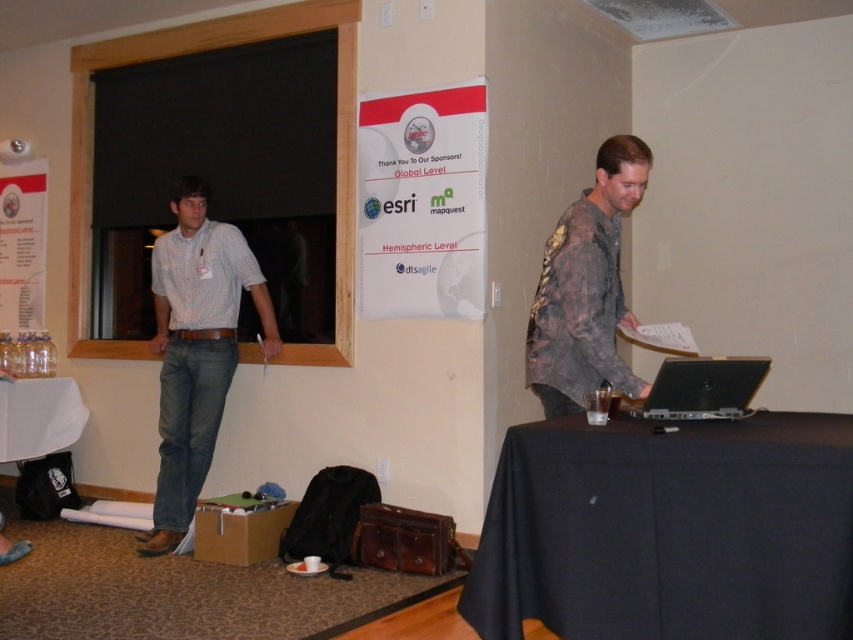
Who is shorter, checkered shirt at left or camouflage fabric shirt at right?

With less height is camouflage fabric shirt at right.

Does checkered shirt at left lie in front of camouflage fabric shirt at right?

No, checkered shirt at left is behind camouflage fabric shirt at right.

I want to click on checkered shirt at left, so click(x=196, y=349).

The image size is (853, 640). Identify the location of checkered shirt at left. (196, 349).

Which of these two, black fabric table at lower right or wooden frame window at left, stands shorter?

black fabric table at lower right is shorter.

Does black fabric table at lower right have a lesser height compared to wooden frame window at left?

Yes.

The image size is (853, 640). What do you see at coordinates (668, 531) in the screenshot? I see `black fabric table at lower right` at bounding box center [668, 531].

The width and height of the screenshot is (853, 640). I want to click on black fabric table at lower right, so click(x=668, y=531).

From the picture: Between camouflage fabric shirt at right and silver metallic laptop at center, which one has more height?

camouflage fabric shirt at right is taller.

Who is more distant from viewer, (546, 410) or (648, 417)?

The point (546, 410) is behind.

Does point (547, 413) come behind point (711, 362)?

Yes.

In order to click on camouflage fabric shirt at right in this screenshot , I will do `click(585, 289)`.